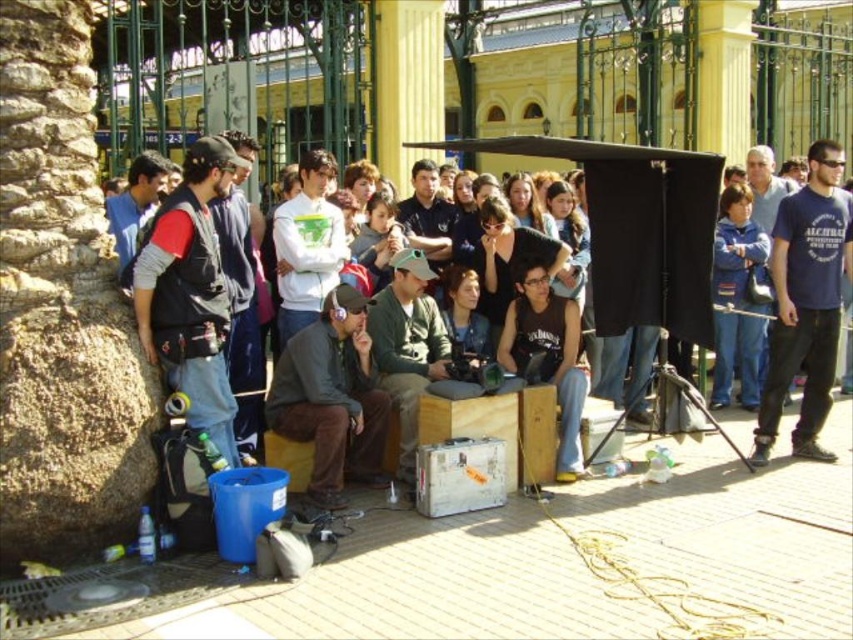
Question: Does blue cotton t-shirt at right have a greater width compared to white matte hoodie at center?

Choices:
 (A) no
 (B) yes

Answer: (B)

Question: Among these objects, which one is nearest to the camera?

Choices:
 (A) black matte tank top at center
 (B) blue cotton t-shirt at right
 (C) black matte vest at left
 (D) white matte hoodie at center

Answer: (C)

Question: Estimate the real-world distances between objects in this image. Which object is farther from the black matte tank top at center?

Choices:
 (A) dark blue t-shirt at right
 (B) green knit cap at center
 (C) dark gray fabric jacket at center
 (D) blue cotton t-shirt at right

Answer: (A)

Question: Does green knit cap at center appear under white matte hoodie at center?

Choices:
 (A) yes
 (B) no

Answer: (A)

Question: Which point is farther to the camera?

Choices:
 (A) (282, 209)
 (B) (322, 472)
 (C) (773, 200)

Answer: (C)

Question: Is blue cotton t-shirt at right below green knit cap at center?

Choices:
 (A) no
 (B) yes

Answer: (A)